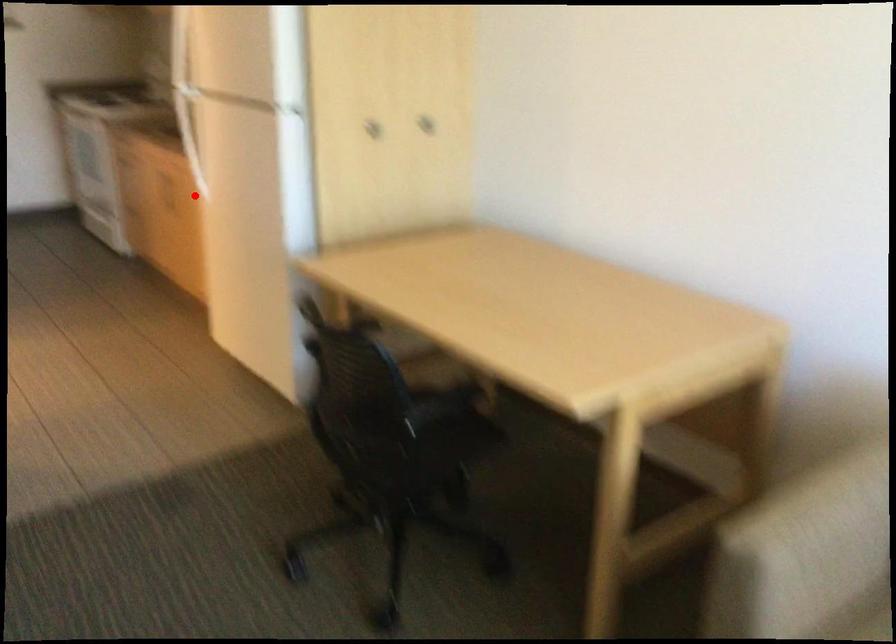
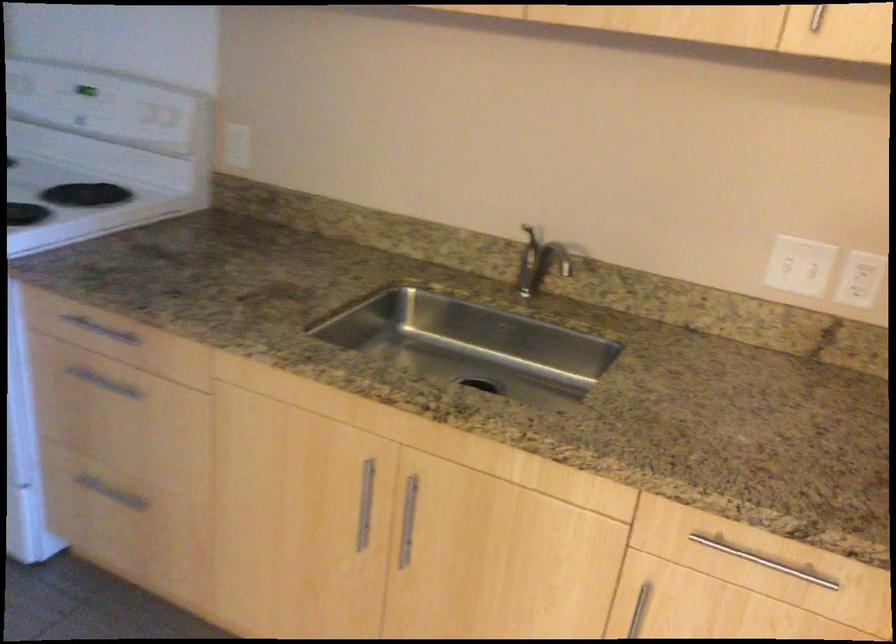
In the second image, find the point that corresponds to the highlighted location in the first image.

(408, 520)